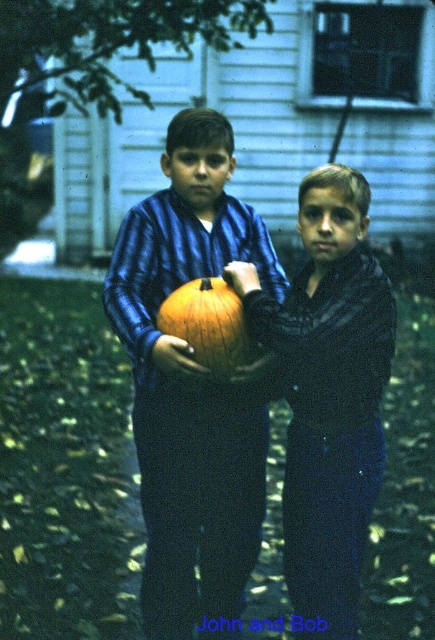
You are trying to decide which item is bigger between the blue striped shirt at center and the orange matte pumpkin at center. Based on the scene, which one is larger?

The blue striped shirt at center is larger in size than the orange matte pumpkin at center.

You are a photographer trying to capture the orange matte pumpkin at center and the blue striped shirt at center in a single shot. Based on their positions, which object is closer to the camera?

The blue striped shirt at center is positioned under the orange matte pumpkin at center, meaning the pumpkin is closer to the camera.